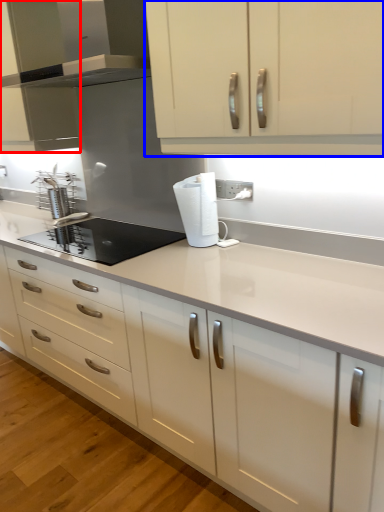
Question: Which object appears closest to the camera in this image, cabinetry (highlighted by a red box) or cabinetry (highlighted by a blue box)?

Choices:
 (A) cabinetry
 (B) cabinetry

Answer: (B)